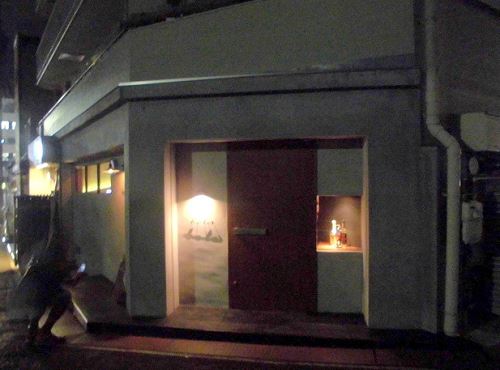
This screenshot has width=500, height=370. Identify the location of windows beside door. (339, 223), (202, 227).